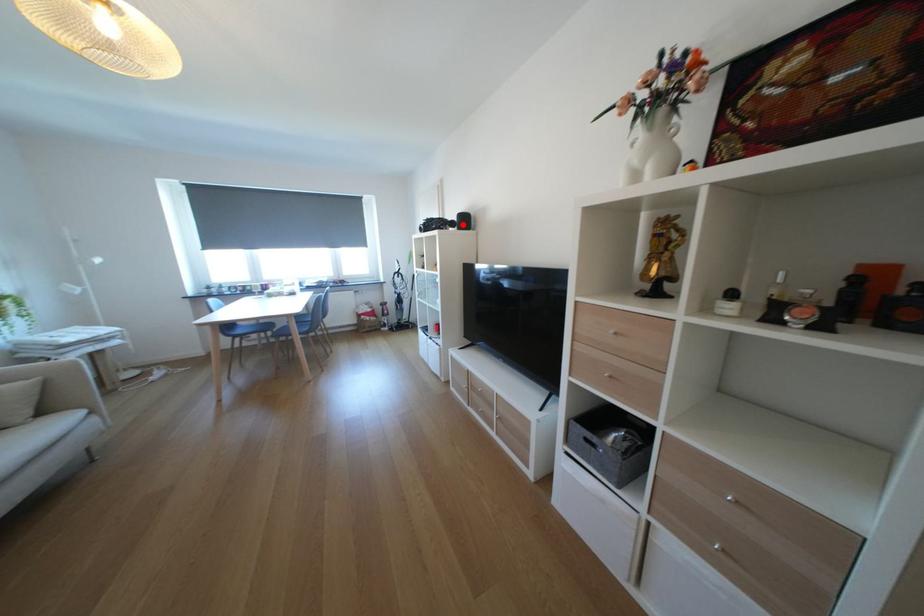
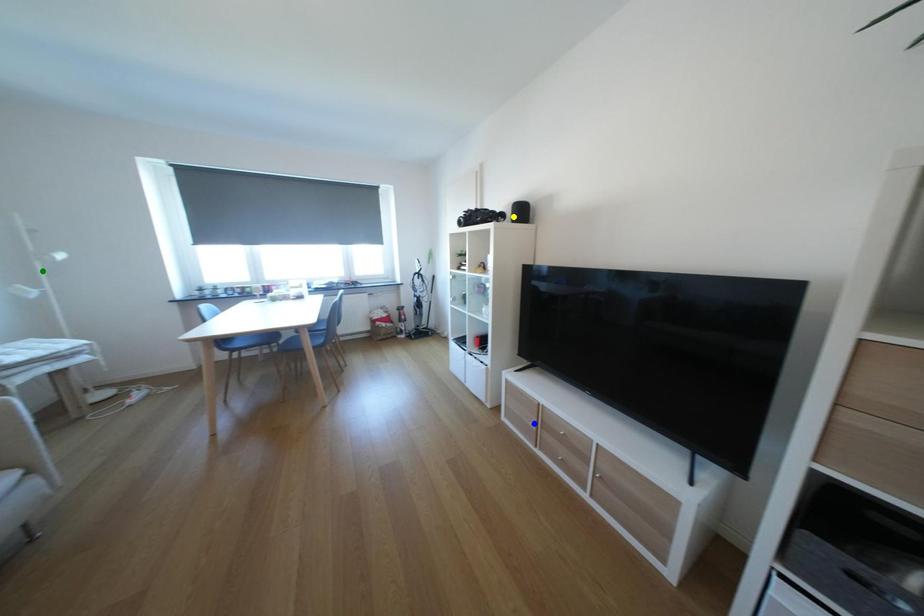
Question: I am providing you with two images of the same scene from different viewpoints. A red point is marked on the first image. You are given multiple points on the second image. In image 2, which mark is for the same physical point as the one in image 1?

Choices:
 (A) green point
 (B) yellow point
 (C) blue point

Answer: (B)